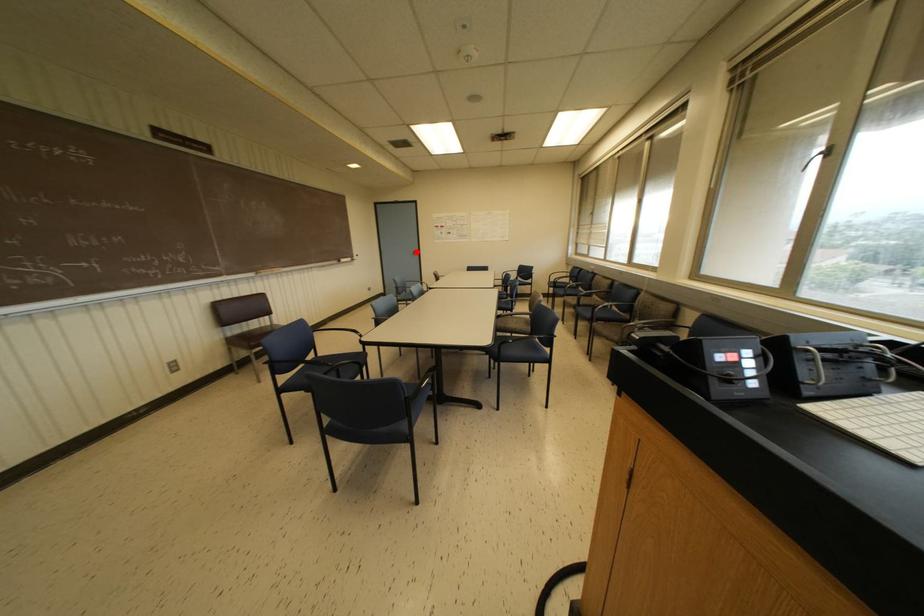
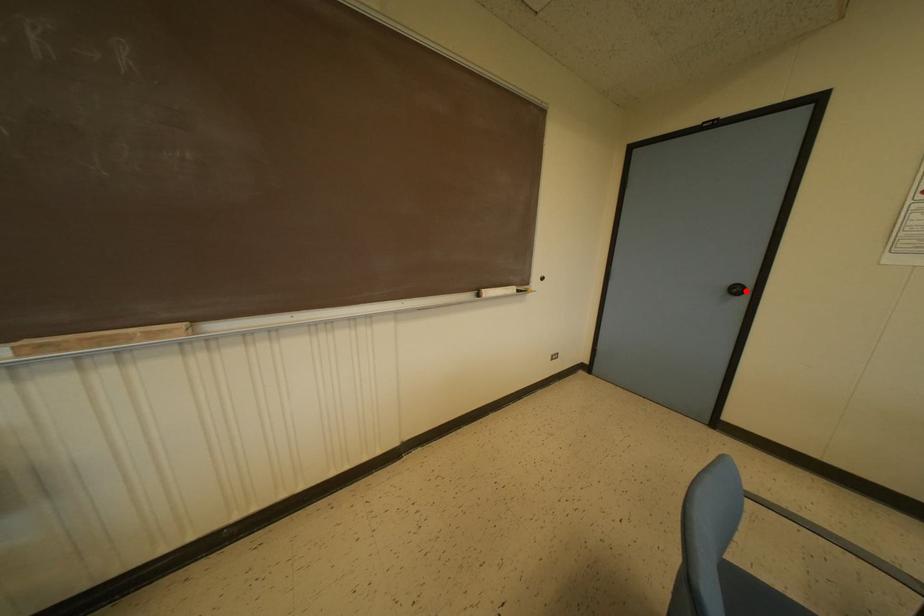
I am providing you with two images of the same scene from different viewpoints. A red point is marked on the first image and another point is marked on the second image. Does the point marked in image1 correspond to the same location as the one in image2?

Yes